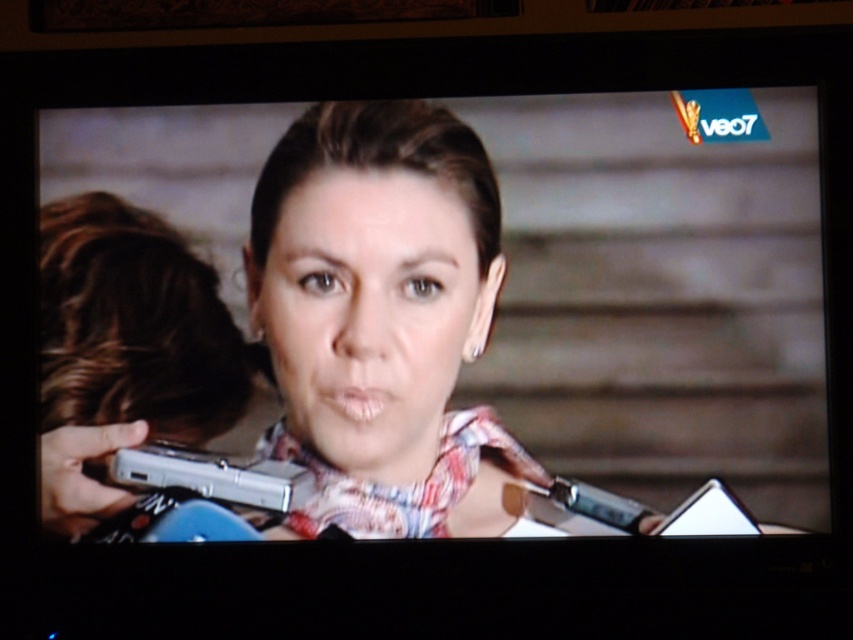
You are a photographer trying to capture the scene on the TV screen. You notice the matte pink scarf at center and the shiny silver phone at left. Which object should you adjust your camera focus to first if you want to ensure both are in frame?

The shiny silver phone at left should be focused on first since it is positioned to the left of the matte pink scarf at center, allowing you to adjust the frame to include both objects.

You are a photographer trying to capture a detailed shot of the woman in the foreground. You notice a point at coordinates point (x=381, y=320). Where exactly is this point located in the image?

The point (x=381, y=320) is on the matte pink scarf at center.